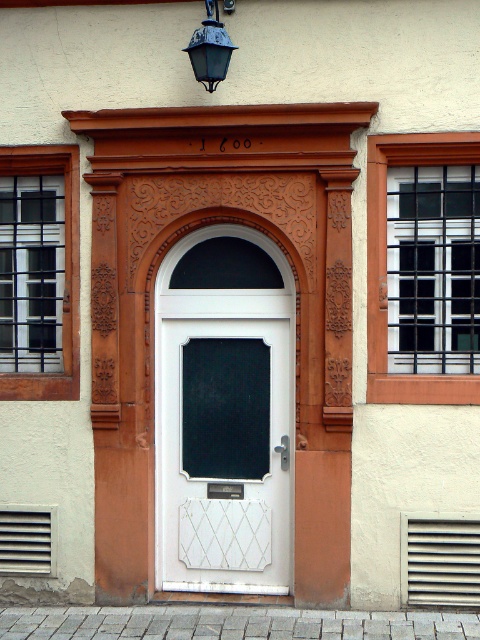
Question: Is matte black glass at left below matte black lantern at upper center?

Choices:
 (A) no
 (B) yes

Answer: (B)

Question: Which of the following is the farthest from the observer?

Choices:
 (A) black metal bars at right
 (B) matte black lantern at upper center

Answer: (A)

Question: Among these objects, which one is nearest to the camera?

Choices:
 (A) matte black lantern at upper center
 (B) black metal bars at right
 (C) matte black glass at left

Answer: (A)

Question: Does white glossy door at center appear under matte black glass at left?

Choices:
 (A) yes
 (B) no

Answer: (A)

Question: Which point is farther to the camera?

Choices:
 (A) (228, 45)
 (B) (372, 400)
 (C) (179, 529)
 (D) (24, 291)

Answer: (D)

Question: In this image, where is white glossy door at center located relative to black metal bars at right?

Choices:
 (A) above
 (B) below

Answer: (B)